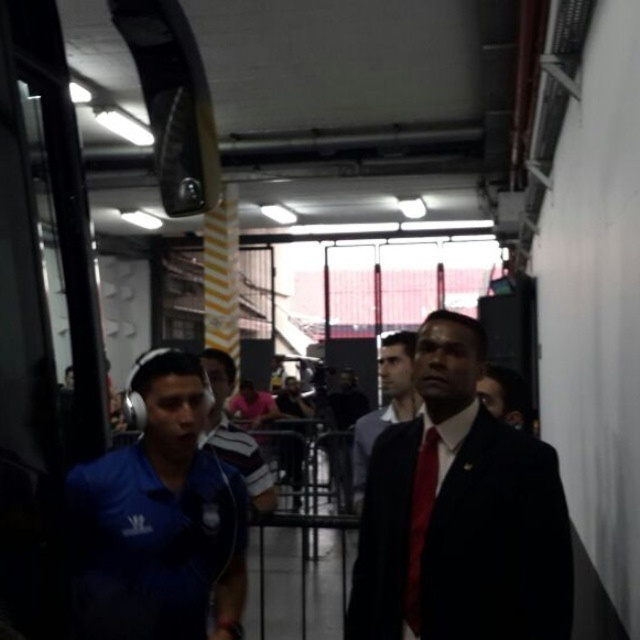
Consider the image. You are standing in the corridor and want to reach the point marked at coordinates (86, 492). Considering your height is 5 feet 6 inches, can you comfortably walk to that point without any obstruction?

The point at coordinates (86, 492) is 5.25 feet away from the camera. Since your height is 5 feet 6 inches, you can comfortably walk to that point as there is no mention of obstructions in the scene description.